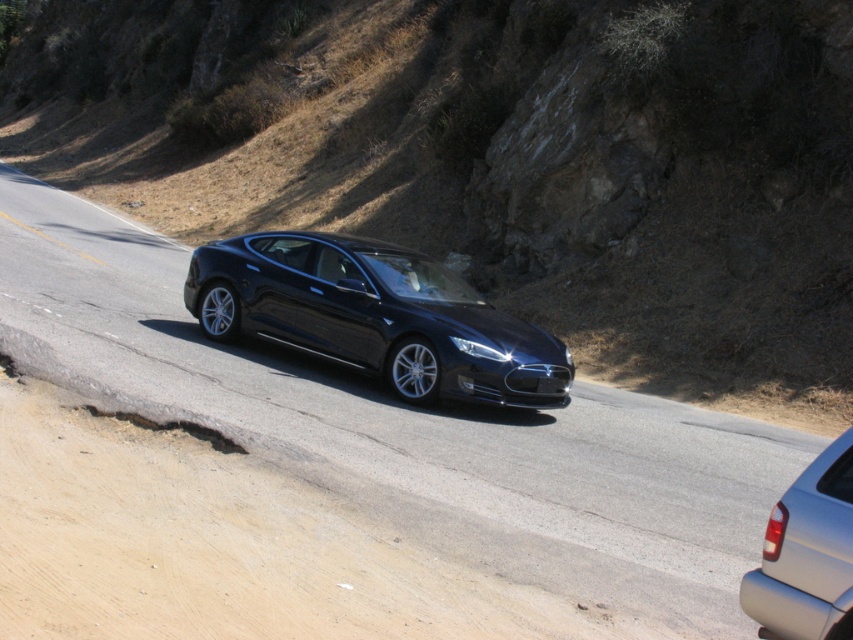
You are a passenger in the glossy black car at center and want to read the black glossy license plate at center. Is the license plate located to the right or left side of the car?

The glossy black car at center is positioned on the left side of the black glossy license plate at center, so the license plate is located to the right side of the car.

You are a passenger in the black Tesla Model S driving along the winding road. You notice two points marked on the road ahead. The first is at coordinate point (196, 349) and the second is at coordinate point (466, 385). Which point is closer to the car?

Point (196, 349) is closer to the car because it is further to the camera than point (466, 385), meaning it is nearer in the line of sight.